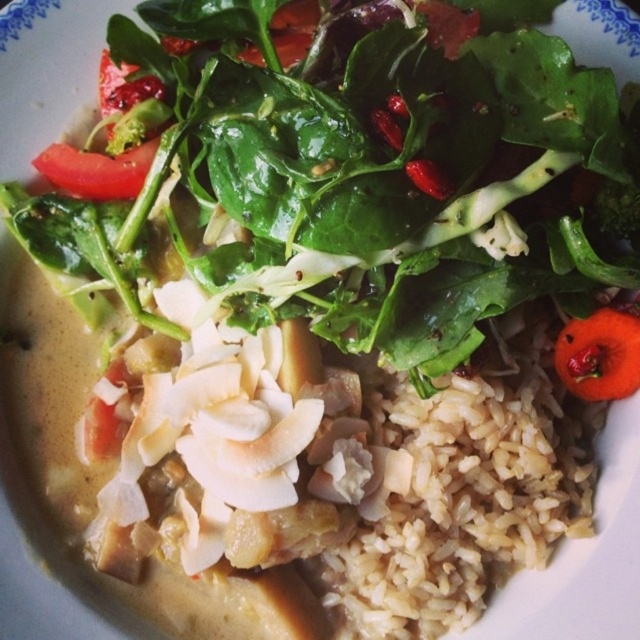
Is point (371, 508) positioned behind point (60, 168)?

No, it is not.

Consider the image. Does brown matte rice at center have a smaller size compared to red matte tomato at upper left?

Incorrect, brown matte rice at center is not smaller in size than red matte tomato at upper left.

The height and width of the screenshot is (640, 640). Find the location of `brown matte rice at center`. brown matte rice at center is located at coordinates (460, 484).

Who is higher up, red matte tomato at upper right or red matte tomato at upper left?

red matte tomato at upper left is higher up.

Which of these two, red matte tomato at upper right or red matte tomato at upper left, stands taller?

red matte tomato at upper right

Locate an element on the screen. red matte tomato at upper right is located at coordinates (600, 355).

Does point (388, 508) come farther from viewer compared to point (609, 333)?

No, it is in front of (609, 333).

Is point (440, 429) positioned before point (609, 336)?

That is True.

Image resolution: width=640 pixels, height=640 pixels. Describe the element at coordinates (460, 484) in the screenshot. I see `brown matte rice at center` at that location.

At what (x,y) coordinates should I click in order to perform the action: click on brown matte rice at center. Please return your answer as a coordinate pair (x, y). This screenshot has height=640, width=640. Looking at the image, I should click on 460,484.